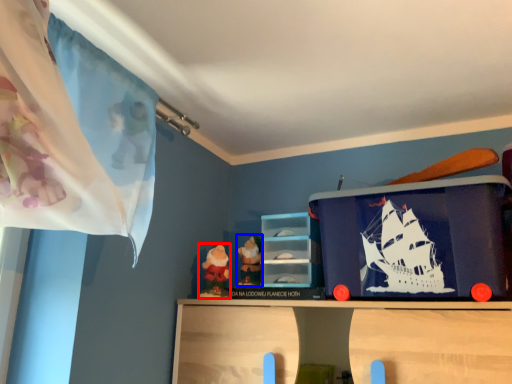
Question: Which of the following is the farthest to the observer, toy (highlighted by a red box) or toy (highlighted by a blue box)?

Choices:
 (A) toy
 (B) toy

Answer: (B)